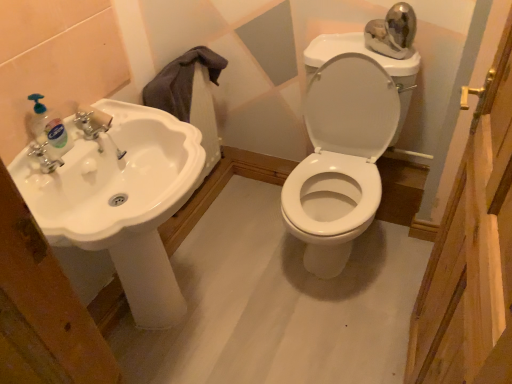
Question: Is white glossy sink at left to the left of white glossy toilet at center from the viewer's perspective?

Choices:
 (A) yes
 (B) no

Answer: (A)

Question: Considering the relative sizes of white glossy sink at left and white glossy toilet at center in the image provided, is white glossy sink at left taller than white glossy toilet at center?

Choices:
 (A) yes
 (B) no

Answer: (B)

Question: Is white glossy sink at left far away from white glossy toilet at center?

Choices:
 (A) no
 (B) yes

Answer: (A)

Question: Are white glossy sink at left and white glossy toilet at center making contact?

Choices:
 (A) no
 (B) yes

Answer: (A)

Question: Does white glossy sink at left have a lesser width compared to white glossy toilet at center?

Choices:
 (A) yes
 (B) no

Answer: (A)

Question: From a real-world perspective, is white glossy sink at left below white glossy toilet at center?

Choices:
 (A) yes
 (B) no

Answer: (B)

Question: Is translucent plastic soap dispenser at left turned away from white glossy toilet at center?

Choices:
 (A) yes
 (B) no

Answer: (B)

Question: Is translucent plastic soap dispenser at left to the left of white glossy toilet at center from the viewer's perspective?

Choices:
 (A) yes
 (B) no

Answer: (A)

Question: Does translucent plastic soap dispenser at left have a lesser height compared to white glossy toilet at center?

Choices:
 (A) yes
 (B) no

Answer: (A)

Question: Is translucent plastic soap dispenser at left bigger than white glossy toilet at center?

Choices:
 (A) yes
 (B) no

Answer: (B)

Question: Does translucent plastic soap dispenser at left have a greater width compared to white glossy toilet at center?

Choices:
 (A) yes
 (B) no

Answer: (B)

Question: From the image's perspective, does translucent plastic soap dispenser at left appear higher than white glossy toilet at center?

Choices:
 (A) yes
 (B) no

Answer: (A)

Question: Is translucent plastic soap dispenser at left taller than white glossy sink at left?

Choices:
 (A) no
 (B) yes

Answer: (A)